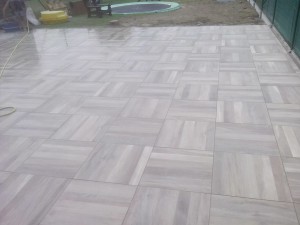
This screenshot has width=300, height=225. What are the coordinates of `bin` in the screenshot? It's located at (53, 15).